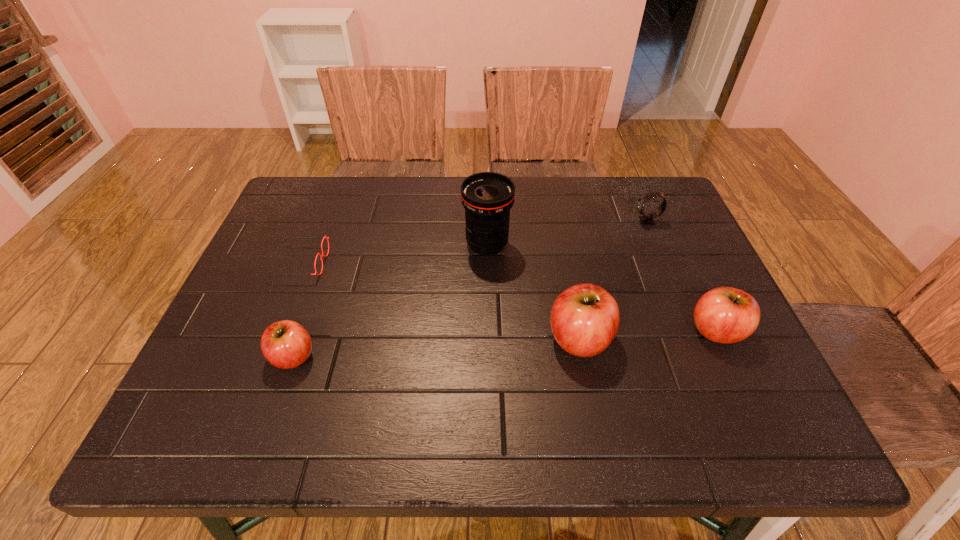
Locate an element on the screen. This screenshot has width=960, height=540. free area in between the second tallest object and the tallest object is located at coordinates (534, 292).

Identify which object is the third nearest to the second tallest apple. Please provide its 2D coordinates. Your answer should be formatted as a tuple, i.e. [(x, y)], where the tuple contains the x and y coordinates of a point satisfying the conditions above.

[(487, 197)]

Identify which object is the fifth closest to the third object from left to right. Please provide its 2D coordinates. Your answer should be formatted as a tuple, i.e. [(x, y)], where the tuple contains the x and y coordinates of a point satisfying the conditions above.

[(726, 315)]

Select which apple appears as the second closest to the second tallest apple. Please provide its 2D coordinates. Your answer should be formatted as a tuple, i.e. [(x, y)], where the tuple contains the x and y coordinates of a point satisfying the conditions above.

[(286, 344)]

Choose which apple is the nearest neighbor to the third object from left to right. Please provide its 2D coordinates. Your answer should be formatted as a tuple, i.e. [(x, y)], where the tuple contains the x and y coordinates of a point satisfying the conditions above.

[(584, 320)]

This screenshot has width=960, height=540. Find the location of `free spot that satisfies the following two spatial constraints: 1. on the front-facing side of the shortest apple; 2. on the right side of the shortest object`. free spot that satisfies the following two spatial constraints: 1. on the front-facing side of the shortest apple; 2. on the right side of the shortest object is located at coordinates (262, 356).

Where is `free spot that satisfies the following two spatial constraints: 1. on the front-facing side of the shortest object; 2. on the right side of the second tallest object`? The height and width of the screenshot is (540, 960). free spot that satisfies the following two spatial constraints: 1. on the front-facing side of the shortest object; 2. on the right side of the second tallest object is located at coordinates (269, 339).

This screenshot has width=960, height=540. I want to click on free location that satisfies the following two spatial constraints: 1. on the front side of the tallest object; 2. on the front-facing side of the shortest object, so click(488, 263).